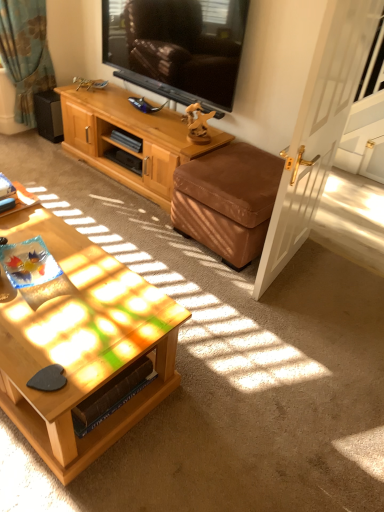
You are a GUI agent. You are given a task and a screenshot of the screen. Output one action in this format:
    pyautogui.click(x=<x>, y=<y>)
    Task: Click on the blank space situated above brown leather ottoman at lower right (from a real-world perspective)
    The image size is (384, 512).
    Given the screenshot: What is the action you would take?
    pyautogui.click(x=240, y=168)